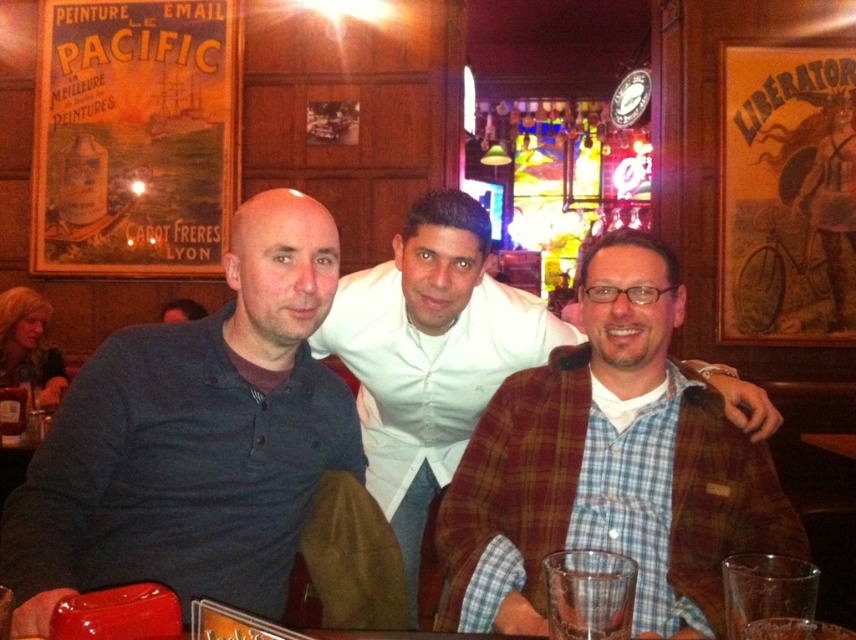
Is dark blue shirt at left to the right of plaid wool jacket at center from the viewer's perspective?

Incorrect, dark blue shirt at left is not on the right side of plaid wool jacket at center.

The width and height of the screenshot is (856, 640). I want to click on dark blue shirt at left, so click(194, 438).